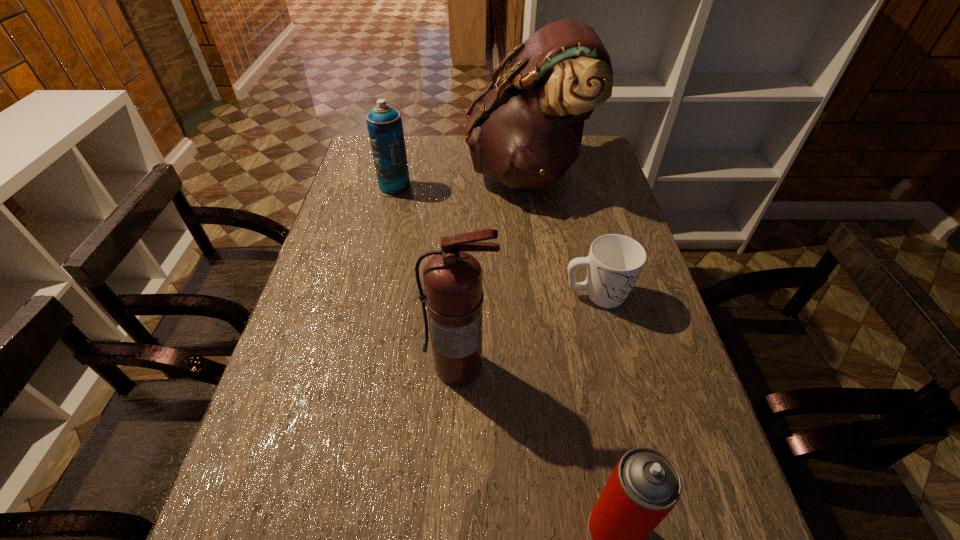
This screenshot has height=540, width=960. Find the location of `object that stands as the closest to the third nearest object`. object that stands as the closest to the third nearest object is located at coordinates (453, 279).

Identify the location of free spot that satisfies the following two spatial constraints: 1. on the side of the shortest object with the handle; 2. on the front-facing side of the second tallest object. (614, 366).